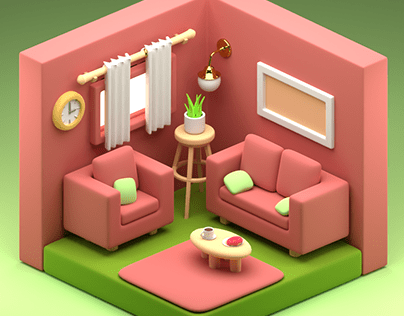
At what (x,y) coordinates should I click in order to perform the action: click on coffee cup. Please return your answer as a coordinate pair (x, y). Image resolution: width=404 pixels, height=316 pixels. Looking at the image, I should click on (206, 232).